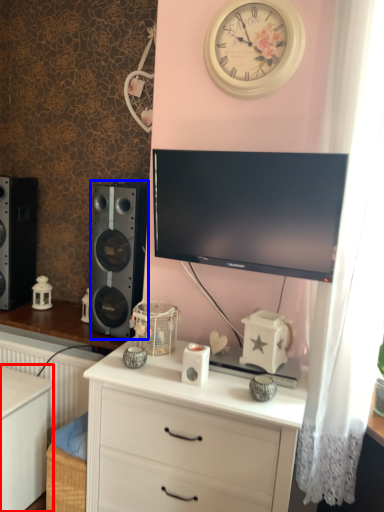
Question: Which object is closer to the camera taking this photo, changing table (highlighted by a red box) or speaker (highlighted by a blue box)?

Choices:
 (A) changing table
 (B) speaker

Answer: (A)